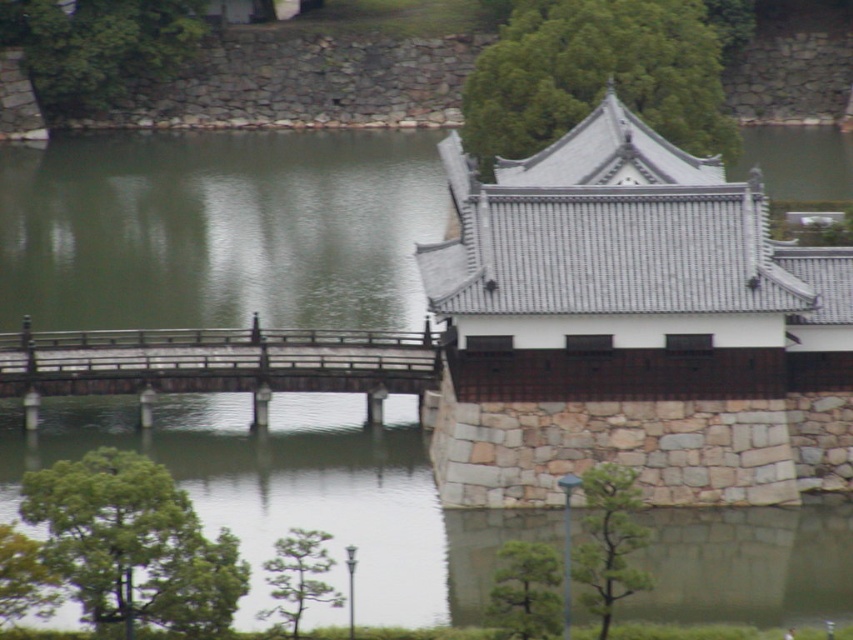
Between point (715, 461) and point (251, 344), which one is positioned in front?

Point (715, 461) is in front.

Is stone tiled roof at upper right positioned in front of wooden bridge at center?

Yes, it is in front of wooden bridge at center.

Which is in front, point (756, 390) or point (24, 390)?

Point (756, 390)

You are a GUI agent. You are given a task and a screenshot of the screen. Output one action in this format:
    pyautogui.click(x=<x>, y=<y>)
    Task: Click on the stone tiled roof at upper right
    The width and height of the screenshot is (853, 640).
    Given the screenshot: What is the action you would take?
    (x=631, y=326)